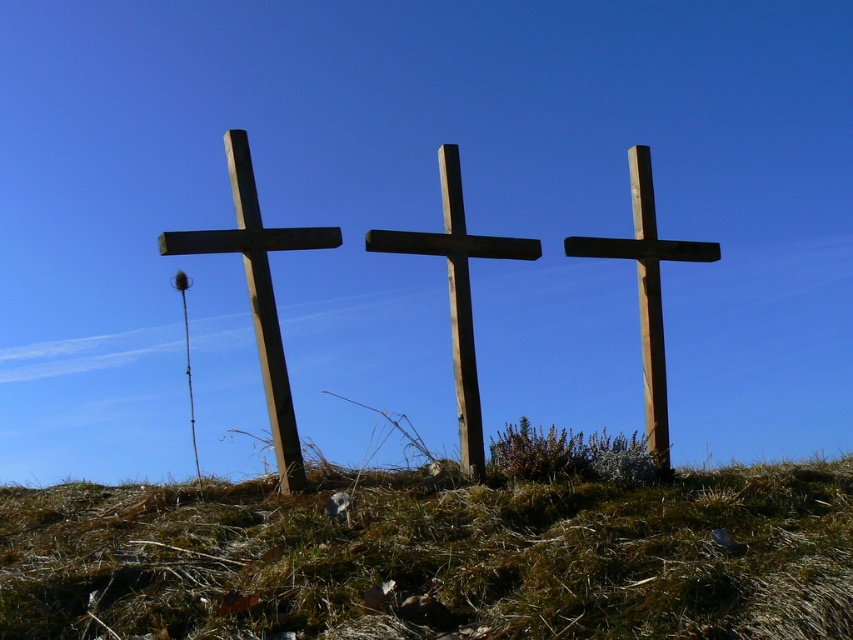
You are standing at the edge of the grassy hill and see the green grassy at center and the wooden cross at center. Which object is located to the right of the other?

The green grassy at center is positioned on the left side of wooden cross at center, so the wooden cross at center is to the right of the green grassy at center.

Based on the photo, you are standing in front of the three wooden crosses on the grassy hill. You notice the green grassy at center and the smooth brown wooden cross at right. Which object is located to the left of the other?

The green grassy at center is positioned on the left side of smooth brown wooden cross at right.